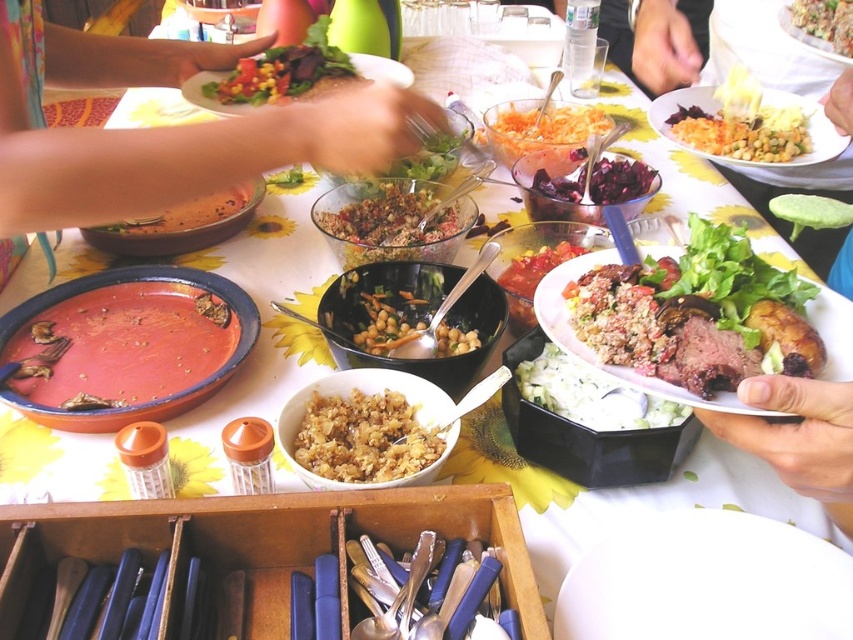
You are a guest at this dining table and want to reach for the rare beef steak at center. If you are sitting at the table, where should you look to find it?

The rare beef steak at center is located at the coordinates point [695,314], so you should look towards the center of the table to find it.

You are a photographer standing at the edge of the table. You want to take a photo of both the salad and the grain dish. The salad is located at point (488, 120) and the grain dish is at point (468, 275). Which dish is closer to your camera?

The salad at point (488, 120) is closer to the camera than the grain dish at point (468, 275) because the point (488, 120) is further to the camera than point (468, 275).

You are at a buffet table and want to serve yourself. You see the carrot salad at center and the silver metallic spoon at center. Which one is larger in size?

The carrot salad at center is bigger than the silver metallic spoon at center, so the carrot salad at center is larger in size.